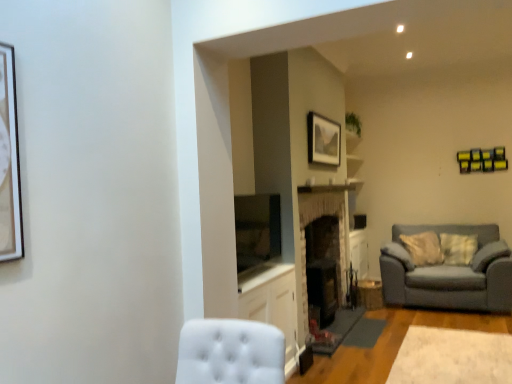
Question: Would you say white plush rug at lower right is to the left or to the right of matte wooden picture frame at upper center in the picture?

Choices:
 (A) left
 (B) right

Answer: (B)

Question: In the image, is white plush rug at lower right positioned in front of or behind matte wooden picture frame at upper center?

Choices:
 (A) behind
 (B) front

Answer: (B)

Question: Estimate the real-world distances between objects in this image. Which object is farther from the dark stone fireplace at center, which is the first fireplace in back-to-front order?

Choices:
 (A) matte wooden picture frame at upper center
 (B) white plush rug at lower right
 (C) gray fabric couch at right
 (D) white glossy cabinet at center
 (E) brick fireplace at center, the 1th fireplace viewed from the front

Answer: (C)

Question: Which is nearer to the matte wooden picture frame at upper center?

Choices:
 (A) gray fabric couch at right
 (B) white glossy cabinet at center
 (C) brick fireplace at center, which is the second fireplace from back to front
 (D) dark stone fireplace at center, placed as the 2th fireplace when sorted from front to back
 (E) white plush rug at lower right

Answer: (C)